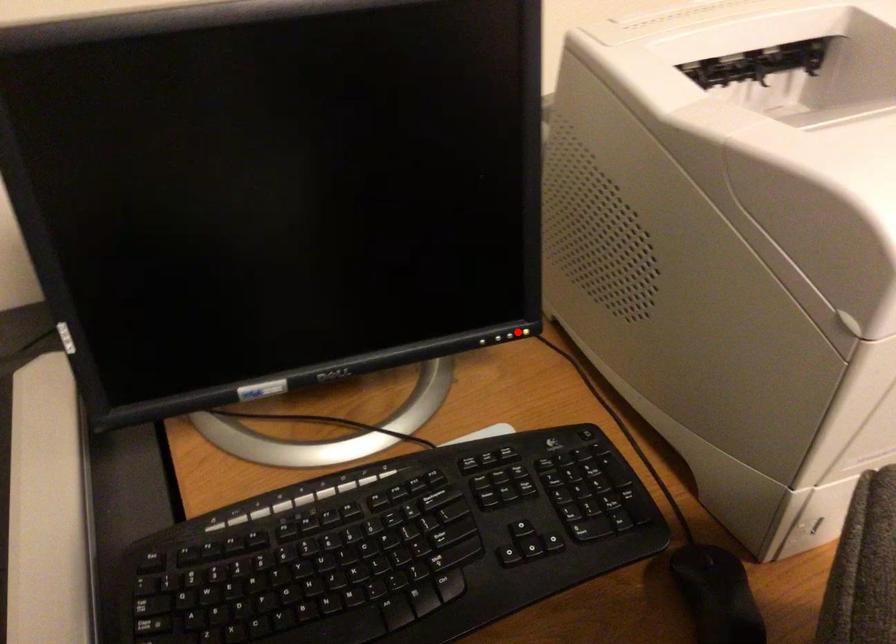
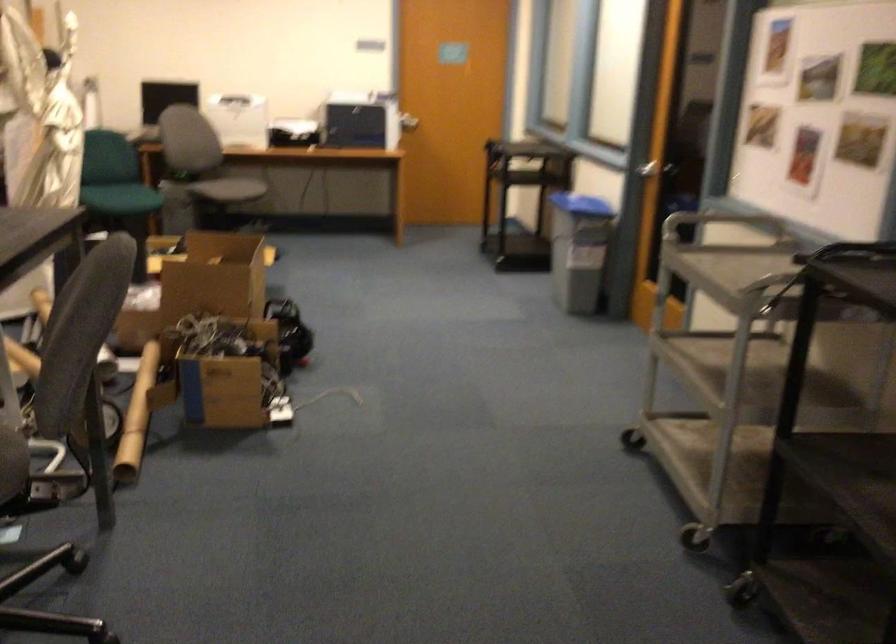
Question: I am providing you with two images of the same scene from different viewpoints. A red point is marked on the first image. Is the red point's position out of view in image 2?

Choices:
 (A) Yes
 (B) No

Answer: (A)